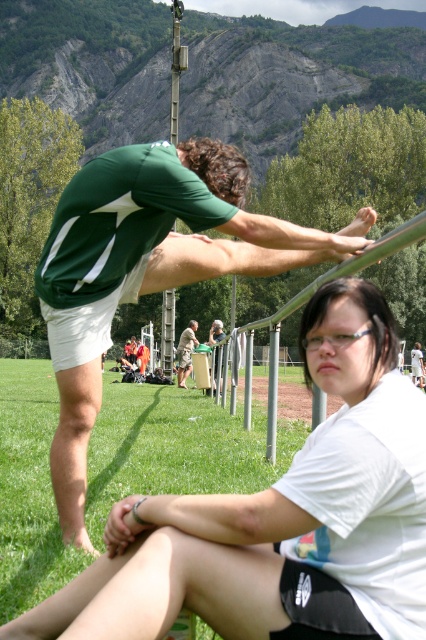
Can you confirm if white matte shirt at lower center is positioned to the right of green fabric shirt at upper left?

Yes, white matte shirt at lower center is to the right of green fabric shirt at upper left.

Between white matte shirt at lower center and green fabric shirt at upper left, which one appears on the left side from the viewer's perspective?

Positioned to the left is green fabric shirt at upper left.

The image size is (426, 640). I want to click on white matte shirt at lower center, so click(281, 516).

The height and width of the screenshot is (640, 426). Identify the location of white matte shirt at lower center. [281, 516].

Is point (78, 486) farther from viewer compared to point (183, 371)?

No, (78, 486) is in front of (183, 371).

From the picture: Who is more forward, (115, 173) or (196, 323)?

Point (115, 173) is in front.

Where is `green fabric shirt at upper left`? The image size is (426, 640). green fabric shirt at upper left is located at coordinates (167, 227).

Who is more distant from viewer, (368, 493) or (190, 344)?

Positioned behind is point (190, 344).

Can you confirm if white matte shirt at lower center is positioned to the left of wooden bench at center?

No, white matte shirt at lower center is not to the left of wooden bench at center.

Does point (396, 401) come closer to viewer compared to point (181, 356)?

Yes, point (396, 401) is closer to viewer.

Identify the location of white matte shirt at lower center. (281, 516).